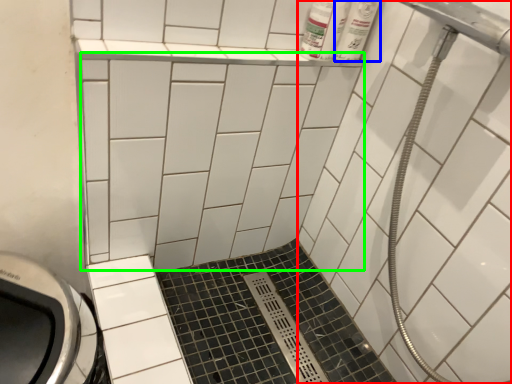
Question: Estimate the real-world distances between objects in this image. Which object is closer to bath (highlighted by a red box), toiletry (highlighted by a blue box) or ceramic tile (highlighted by a green box)?

Choices:
 (A) toiletry
 (B) ceramic tile

Answer: (B)